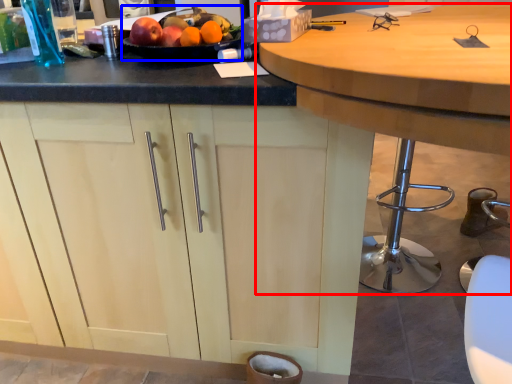
Question: Which of the following is the closest to the observer, table (highlighted by a red box) or fruit dish (highlighted by a blue box)?

Choices:
 (A) table
 (B) fruit dish

Answer: (A)